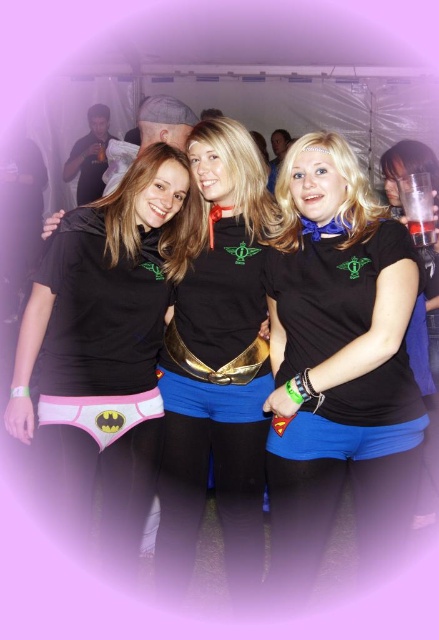
Question: Does matte black shirt at center appear over pink fabric underwear at lower left?

Choices:
 (A) yes
 (B) no

Answer: (A)

Question: Can you confirm if matte black shirt at center is bigger than pink fabric underwear at lower left?

Choices:
 (A) yes
 (B) no

Answer: (A)

Question: Which of the following is the farthest from the observer?

Choices:
 (A) (262, 387)
 (B) (97, 422)

Answer: (A)

Question: In this image, where is pink fabric underwear at left located relative to pink fabric underwear at lower left?

Choices:
 (A) above
 (B) below

Answer: (A)

Question: Which point is farther to the camera?

Choices:
 (A) pink fabric underwear at lower left
 (B) pink fabric underwear at left
 (C) blue matte shorts at center

Answer: (A)

Question: Which object is closer to the camera taking this photo?

Choices:
 (A) pink fabric underwear at lower left
 (B) matte black shirt at center

Answer: (A)